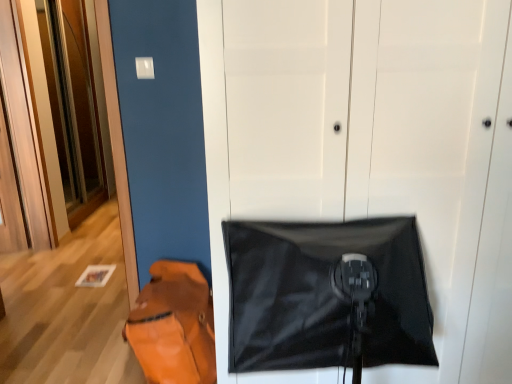
Question: Visually, is black matte blanket at center positioned to the left or to the right of wooden at left, arranged as the 1th door when viewed from the back?

Choices:
 (A) left
 (B) right

Answer: (B)

Question: In terms of size, does black matte blanket at center appear bigger or smaller than wooden at left, arranged as the 1th door when viewed from the back?

Choices:
 (A) big
 (B) small

Answer: (A)

Question: Estimate the real-world distances between objects in this image. Which object is closer to the black matte door at center, which appears as the second door when viewed from the left?

Choices:
 (A) leather-like orange messenger bag at lower left
 (B) black matte blanket at center
 (C) wooden at left, arranged as the 1th door when viewed from the back

Answer: (B)

Question: Which is farther from the leather-like orange messenger bag at lower left?

Choices:
 (A) black matte blanket at center
 (B) black matte door at center, marked as the 1th door in a right-to-left arrangement
 (C) wooden at left, acting as the 2th door starting from the right

Answer: (C)